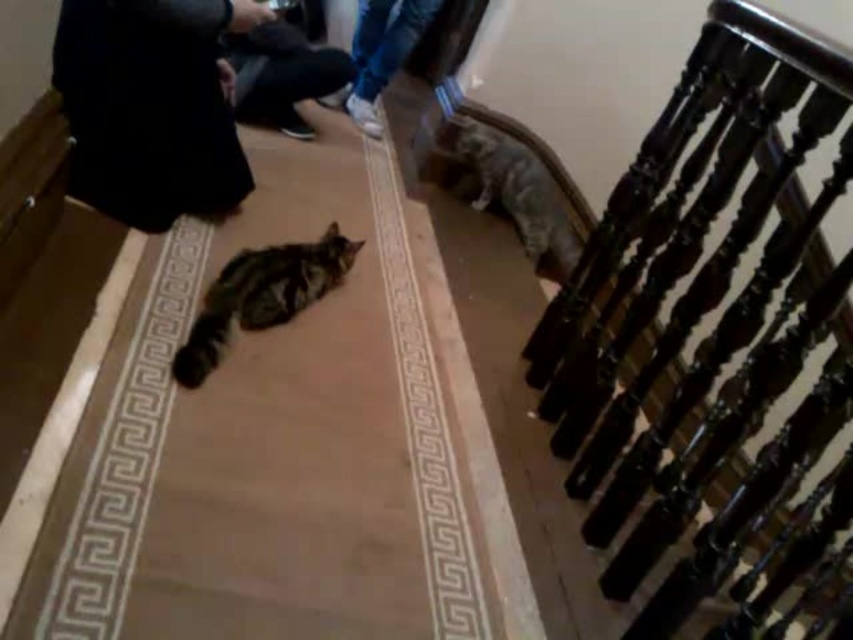
Question: Is black fabric at upper left positioned at the back of black fabric pants at upper left?

Choices:
 (A) yes
 (B) no

Answer: (B)

Question: Which point is farther to the camera?

Choices:
 (A) tabby fur cat at center
 (B) black polished wood railing at upper right

Answer: (A)

Question: Which point appears closest to the camera in this image?

Choices:
 (A) (386, 26)
 (B) (302, 38)
 (C) (752, 184)
 (D) (265, 280)

Answer: (C)

Question: Does black polished wood railing at upper right have a greater width compared to tabby fur cat at upper right?

Choices:
 (A) no
 (B) yes

Answer: (A)

Question: In this image, where is tabby fur cat at center located relative to denim pants at upper center?

Choices:
 (A) below
 (B) above

Answer: (A)

Question: Which object is the farthest from the black polished wood railing at upper right?

Choices:
 (A) tabby fur cat at upper right
 (B) tabby fur cat at center
 (C) black fabric at upper left
 (D) denim pants at upper center

Answer: (D)